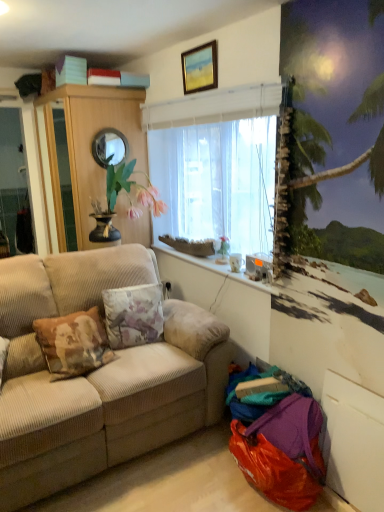
Question: Is floral fabric pillow at center thinner than wooden picture frame at upper center?

Choices:
 (A) yes
 (B) no

Answer: (B)

Question: Is floral fabric pillow at center behind wooden picture frame at upper center?

Choices:
 (A) yes
 (B) no

Answer: (B)

Question: Can you confirm if floral fabric pillow at center is positioned to the right of wooden picture frame at upper center?

Choices:
 (A) yes
 (B) no

Answer: (B)

Question: Is floral fabric pillow at center bigger than wooden picture frame at upper center?

Choices:
 (A) no
 (B) yes

Answer: (B)

Question: Would you say floral fabric pillow at center is outside wooden picture frame at upper center?

Choices:
 (A) no
 (B) yes

Answer: (B)

Question: Choose the correct answer: Is translucent fabric at center inside wooden cabinet at left or outside it?

Choices:
 (A) inside
 (B) outside

Answer: (B)

Question: Is point (147, 122) positioned closer to the camera than point (107, 99)?

Choices:
 (A) closer
 (B) farther

Answer: (A)

Question: In the image, is translucent fabric at center positioned in front of or behind wooden cabinet at left?

Choices:
 (A) front
 (B) behind

Answer: (A)

Question: Based on their sizes in the image, would you say translucent fabric at center is bigger or smaller than wooden cabinet at left?

Choices:
 (A) big
 (B) small

Answer: (B)

Question: In the image, is white marble window sill at center on the left side or the right side of white glossy coffee cup at lower right?

Choices:
 (A) right
 (B) left

Answer: (B)

Question: Do you think white marble window sill at center is within white glossy coffee cup at lower right, or outside of it?

Choices:
 (A) inside
 (B) outside

Answer: (B)

Question: Relative to white glossy coffee cup at lower right, is white marble window sill at center in front or behind?

Choices:
 (A) front
 (B) behind

Answer: (A)

Question: From a real-world perspective, relative to white glossy coffee cup at lower right, is white marble window sill at center vertically above or below?

Choices:
 (A) below
 (B) above

Answer: (A)

Question: In terms of width, does wooden picture frame at upper center look wider or thinner when compared to beige corduroy couch at left?

Choices:
 (A) thin
 (B) wide

Answer: (A)

Question: Would you say wooden picture frame at upper center is to the left or to the right of beige corduroy couch at left in the picture?

Choices:
 (A) left
 (B) right

Answer: (B)